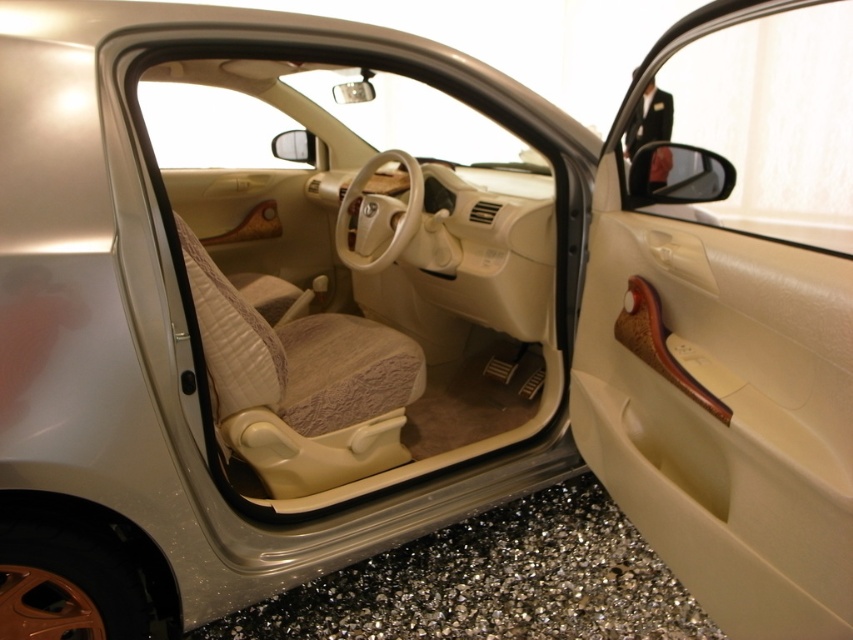
Is beige fabric door at center positioned before wooden handle at center?

Yes, beige fabric door at center is in front of wooden handle at center.

Who is positioned more to the right, beige fabric door at center or wooden handle at center?

wooden handle at center is more to the right.

Which is in front, point (184, 196) or point (660, 500)?

Positioned in front is point (660, 500).

Locate an element on the screen. This screenshot has width=853, height=640. beige fabric door at center is located at coordinates (367, 275).